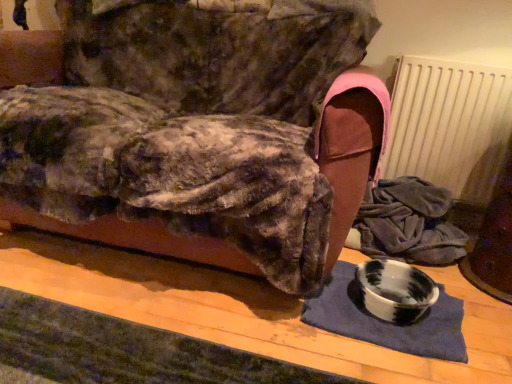
Question: From a real-world perspective, is marbled ceramic bowl at lower right physically located above or below white matte radiator at upper right?

Choices:
 (A) above
 (B) below

Answer: (B)

Question: Is marbled ceramic bowl at lower right to the left or to the right of white matte radiator at upper right in the image?

Choices:
 (A) left
 (B) right

Answer: (A)

Question: Which is farther from the marble bowl at lower right?

Choices:
 (A) white matte radiator at upper right
 (B) marbled ceramic bowl at lower right

Answer: (A)

Question: Which is nearer to the marbled ceramic bowl at lower right?

Choices:
 (A) white matte radiator at upper right
 (B) marble bowl at lower right

Answer: (B)